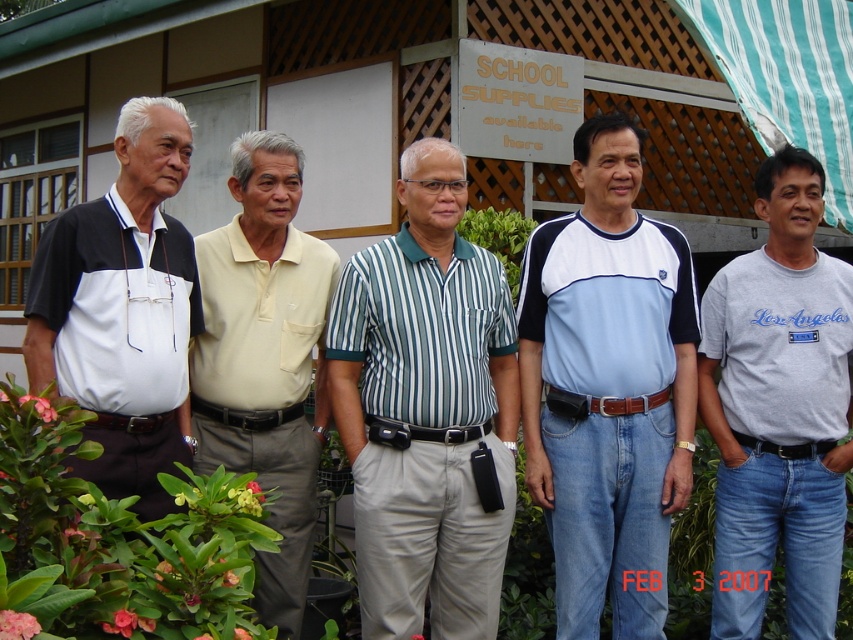
You are a photographer trying to capture a clear shot of the SCHOOL SUPPLIES sign. You notice two men in the foreground wearing a green striped shirt at center and a light yellow polo shirt at center. Which man should you ask to move so the sign is visible?

The green striped shirt at center is positioned under the light yellow polo shirt at center. To ensure the SCHOOL SUPPLIES sign is visible, you should ask the man wearing the green striped shirt at center to move, as he is closer to the camera and blocking the view.

You are taking a photo of the SCHOOL SUPPLIES sign and notice two points marked on the image. The first point is at coordinate point [534,230] and the second is at point [508,516]. If you want to focus on the point closer to the camera, which point should you choose?

Point [508,516] is closer to the camera than point [534,230], so you should choose point [508,516] to focus on the point closer to the camera.

You are a photographer who wants to focus on the green striped shirt at center. Based on the scene description, where should you adjust your camera to aim?

A: The green striped shirt at center is located at point 0.641 on the x axis and 0.499 on the y axis, so you should aim your camera towards those coordinates to focus on it.